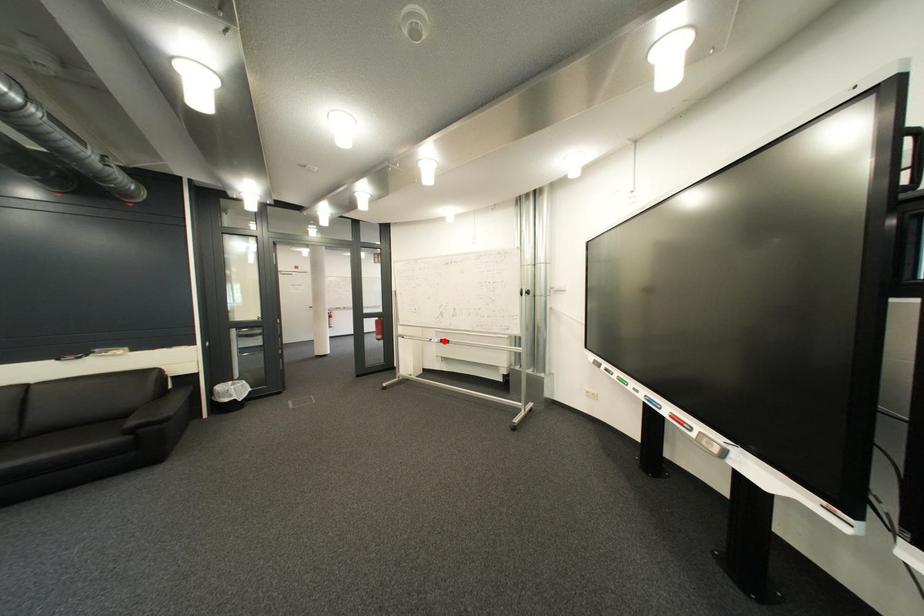
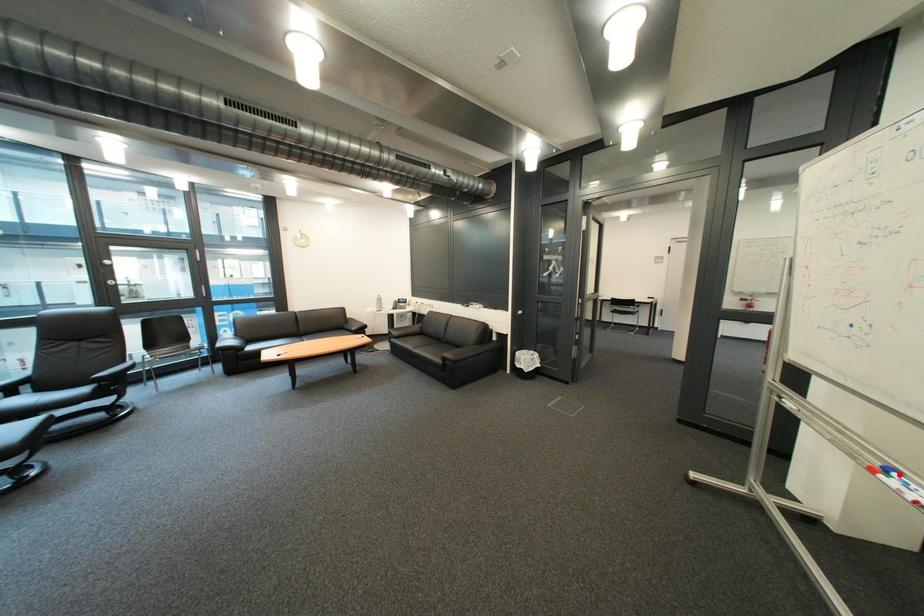
I am providing you with two images of the same scene from different viewpoints. A red point is marked on the first image and another point is marked on the second image. Does the point marked in image1 correspond to the same location as the one in image2?

No